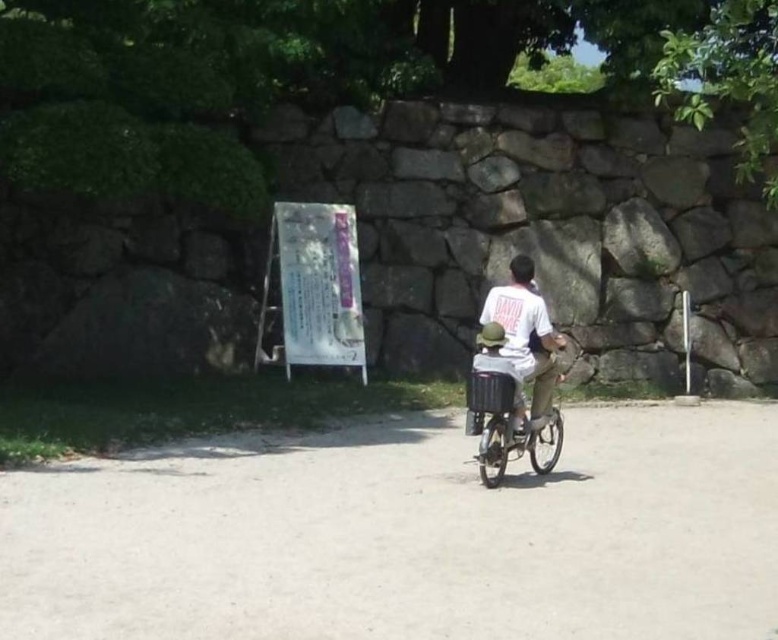
You are a pedestrian walking on the paved path and see the metallic silver tricycle at center and the white cotton shirt at center. Which object is located to the left?

The metallic silver tricycle at center is positioned on the left side of white cotton shirt at center, so it is located to the left.

You are a parent trying to decide whether to let your child ride the metallic silver tricycle at center while wearing the white cotton shirt at center. Considering the size of the tricycle, will the shirt be visible from behind the child?

The metallic silver tricycle at center is larger than the white cotton shirt at center, so the shirt may not be fully visible from behind the child due to the tricycle obstructing the view.

You are standing at the point with coordinates (503,420). Looking around, you see a metallic silver tricycle at center. Can you tell me which object you are standing on?

The point with coordinates (503,420) is on the metallic silver tricycle at center, so you are standing on the metallic silver tricycle at center.